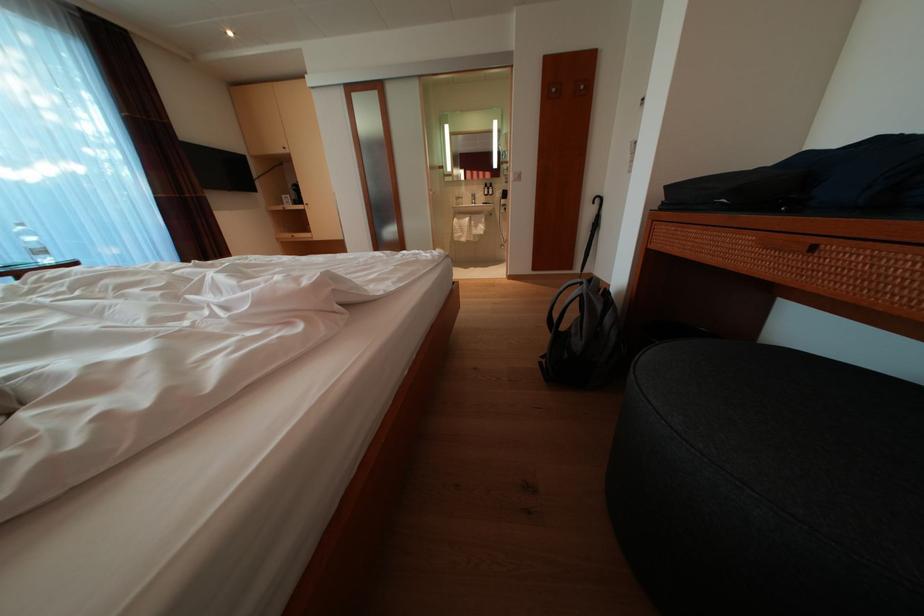
Where is `grey backpack`? The image size is (924, 616). grey backpack is located at coordinates (581, 337).